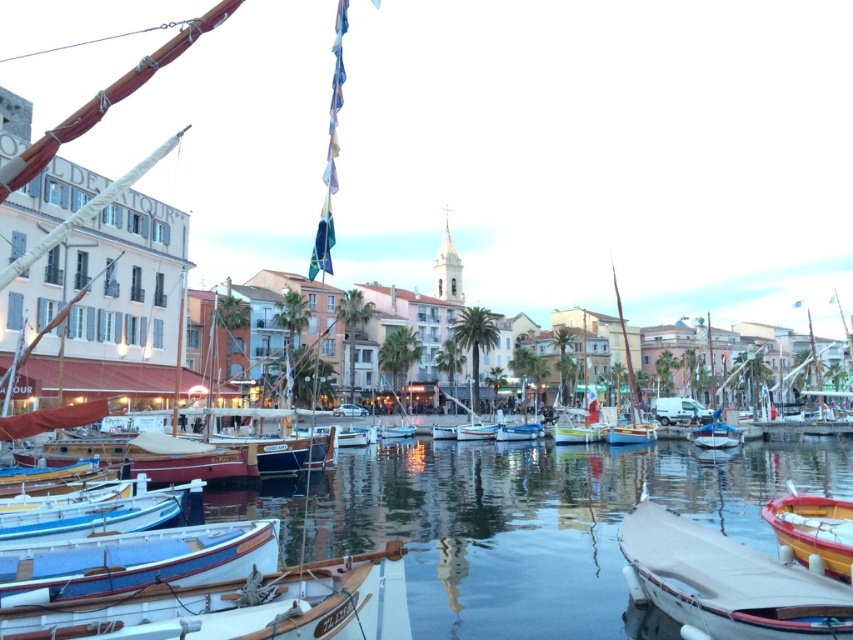
Question: Which object is closer to the camera taking this photo?

Choices:
 (A) white canvas boat at lower right
 (B) wooden boat at lower right
 (C) wooden boat at lower left

Answer: (C)

Question: Estimate the real-world distances between objects in this image. Which object is farther from the white canvas boat at lower right?

Choices:
 (A) blue polished wood boat at lower left
 (B) wooden boat at lower left
 (C) wooden sailboat at center
 (D) wooden boat at lower right

Answer: (C)

Question: Which object appears farthest from the camera in this image?

Choices:
 (A) white canvas boat at lower right
 (B) wooden sailboat at center
 (C) blue polished wood boat at lower left
 (D) wooden boat at lower right

Answer: (B)

Question: Where is blue polished wood boat at lower left located in relation to wooden boat at lower right in the image?

Choices:
 (A) left
 (B) right

Answer: (A)

Question: Considering the relative positions of blue polished wood boat at lower left and wooden boat at lower right in the image provided, where is blue polished wood boat at lower left located with respect to wooden boat at lower right?

Choices:
 (A) right
 (B) left

Answer: (B)

Question: Is white canvas boat at lower right wider than wooden sailboat at center?

Choices:
 (A) no
 (B) yes

Answer: (A)